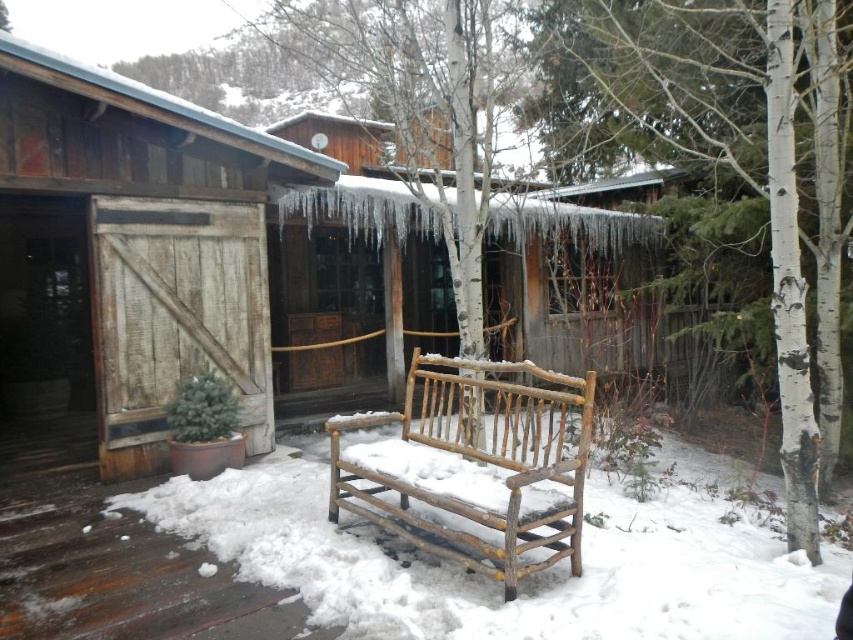
You are standing in a snowy area and see a weathered wood cabin at left. There is a point at coordinates (131, 250). Where is this point located?

The point at (131, 250) is located on the weathered wood cabin at left.

You are standing in front of the weathered wood cabin at left and the weathered wood barn door at left. Which one has a greater height?

The weathered wood barn door at left is taller than the weathered wood cabin at left, so the barn door has a greater height.